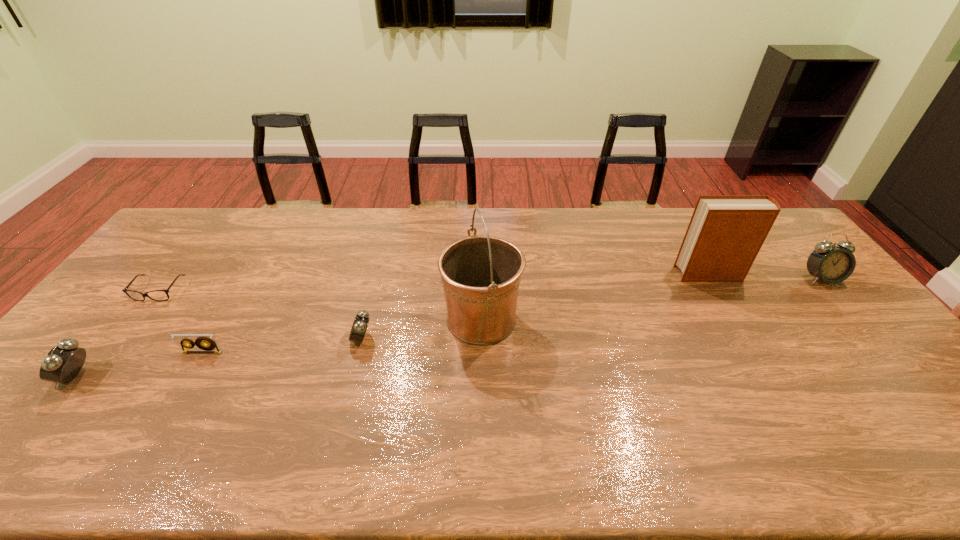
Identify the location of the second tallest alarm clock. (62, 364).

Image resolution: width=960 pixels, height=540 pixels. What are the coordinates of `the leftmost alarm clock` in the screenshot? It's located at (62, 364).

I want to click on the second farthest alarm clock, so click(361, 321).

At what (x,y) coordinates should I click in order to perform the action: click on the fourth object from left to right. Please return your answer as a coordinate pair (x, y). Looking at the image, I should click on (361, 321).

Image resolution: width=960 pixels, height=540 pixels. Find the location of `the tallest alarm clock`. the tallest alarm clock is located at coordinates (832, 264).

I want to click on the farthest alarm clock, so click(x=832, y=264).

You are a GUI agent. You are given a task and a screenshot of the screen. Output one action in this format:
    pyautogui.click(x=<x>, y=<y>)
    Task: Click on the videotape
    This screenshot has height=540, width=960.
    Given the screenshot: What is the action you would take?
    pyautogui.click(x=205, y=343)

Where is `the sixth tallest object`? The width and height of the screenshot is (960, 540). the sixth tallest object is located at coordinates (205, 343).

I want to click on bucket, so click(480, 274).

Identify the location of the third object from right to left. The width and height of the screenshot is (960, 540). (480, 274).